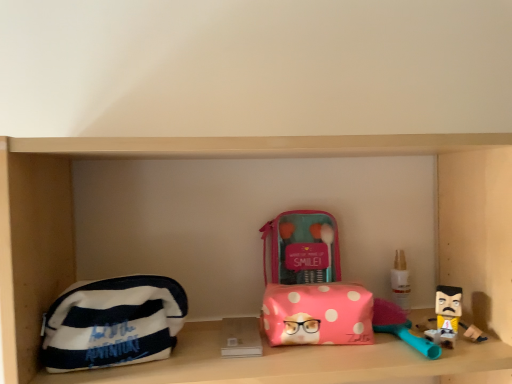
Question: From the image's perspective, is white striped fabric pouch at left, the 1th pouch from the left, above or below white plastic bottle at right?

Choices:
 (A) below
 (B) above

Answer: (A)

Question: Is white striped fabric pouch at left, the 1th pouch from the left, inside the boundaries of white plastic bottle at right, or outside?

Choices:
 (A) inside
 (B) outside

Answer: (B)

Question: Considering the real-world distances, which object is farthest from the pink fabric makeup kit at center?

Choices:
 (A) white plastic bottle at right
 (B) pink polka dot pouch at center, which ranks as the second pouch in left-to-right order
 (C) white striped fabric pouch at left, the 1th pouch from the left

Answer: (C)

Question: Which of these objects is positioned farthest from the pink polka dot pouch at center, which is the first pouch in right-to-left order?

Choices:
 (A) pink fabric makeup kit at center
 (B) white striped fabric pouch at left, which ranks as the second pouch in right-to-left order
 (C) white plastic bottle at right

Answer: (C)